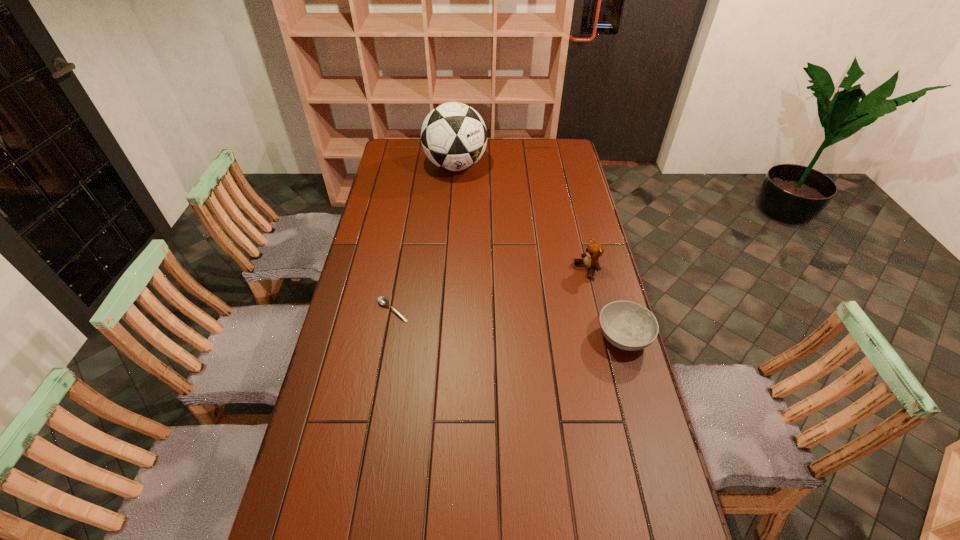
The image size is (960, 540). What are the coordinates of `vacant area that lies between the third nearest object and the second shortest object` in the screenshot? It's located at 605,303.

Locate an element on the screen. empty space that is in between the farthest object and the third tallest object is located at coordinates (540, 251).

Where is `object that stands as the third closest to the third shortest object`? The width and height of the screenshot is (960, 540). object that stands as the third closest to the third shortest object is located at coordinates click(x=383, y=301).

You are a GUI agent. You are given a task and a screenshot of the screen. Output one action in this format:
    pyautogui.click(x=<x>, y=<y>)
    Task: Click on the object that stands as the second closest to the shortest object
    
    Given the screenshot: What is the action you would take?
    point(627,325)

Locate an element on the screen. The image size is (960, 540). free spot that satisfies the following two spatial constraints: 1. on the front side of the second shortest object; 2. on the left side of the teddy bear is located at coordinates (602, 336).

You are a GUI agent. You are given a task and a screenshot of the screen. Output one action in this format:
    pyautogui.click(x=<x>, y=<y>)
    Task: Click on the free spot that satisfies the following two spatial constraints: 1. on the front side of the soupspoon; 2. on the left side of the third tallest object
    This screenshot has height=540, width=960.
    Given the screenshot: What is the action you would take?
    pyautogui.click(x=389, y=336)